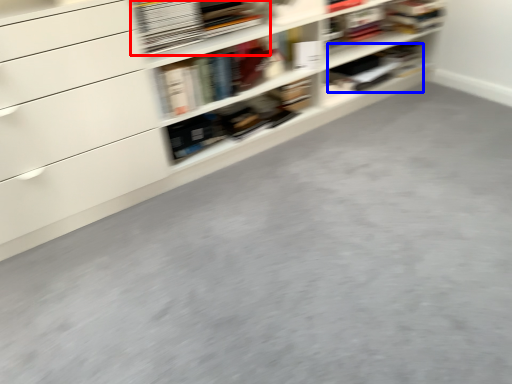
Question: Which object is closer to the camera taking this photo, book (highlighted by a red box) or book (highlighted by a blue box)?

Choices:
 (A) book
 (B) book

Answer: (A)